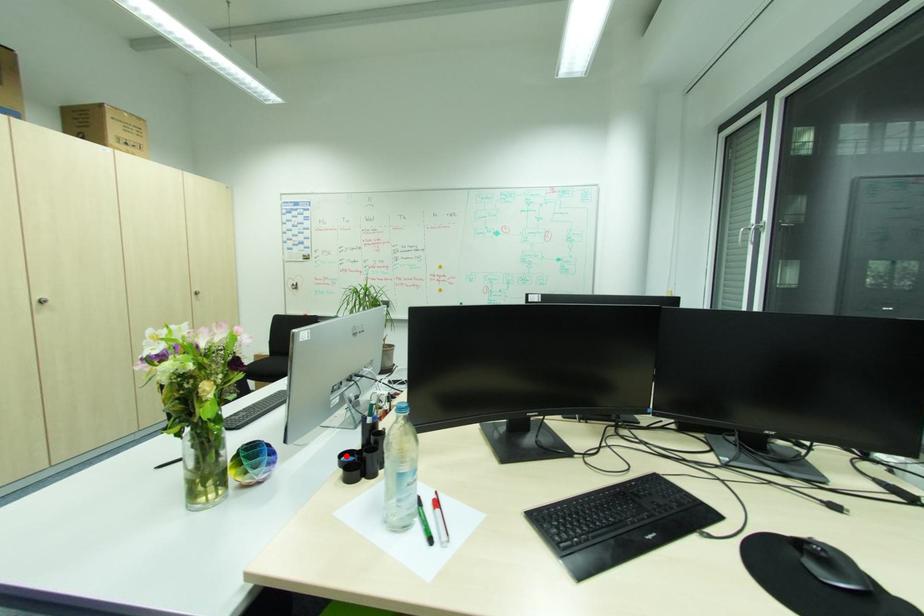
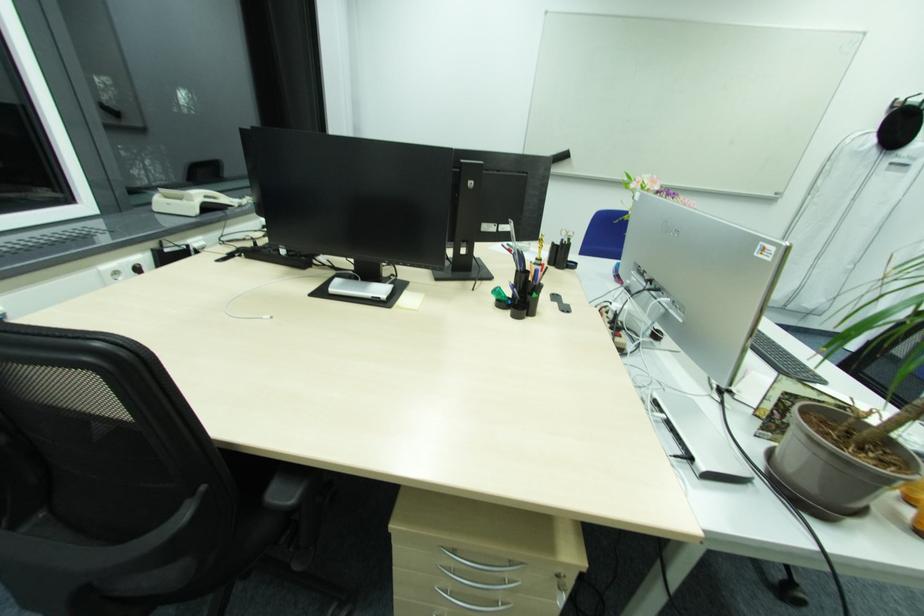
Question: I am providing you with two images of the same scene from different viewpoints. A red point is marked on the first image. Is the red point's position out of view in image 2?

Choices:
 (A) Yes
 (B) No

Answer: (A)